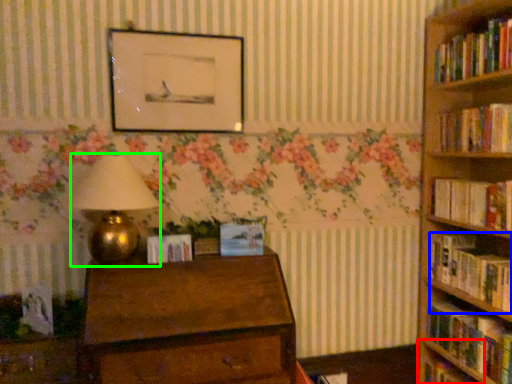
Question: Estimate the real-world distances between objects in this image. Which object is farther from shelf (highlighted by a red box), book (highlighted by a blue box) or table lamp (highlighted by a green box)?

Choices:
 (A) book
 (B) table lamp

Answer: (B)